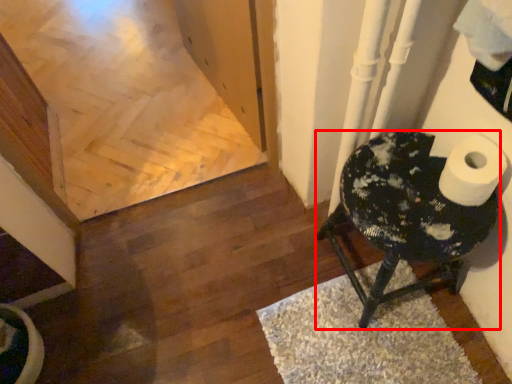
Question: From the image's perspective, what is the correct spatial relationship of furniture (annotated by the red box) in relation to doormat?

Choices:
 (A) above
 (B) below

Answer: (A)